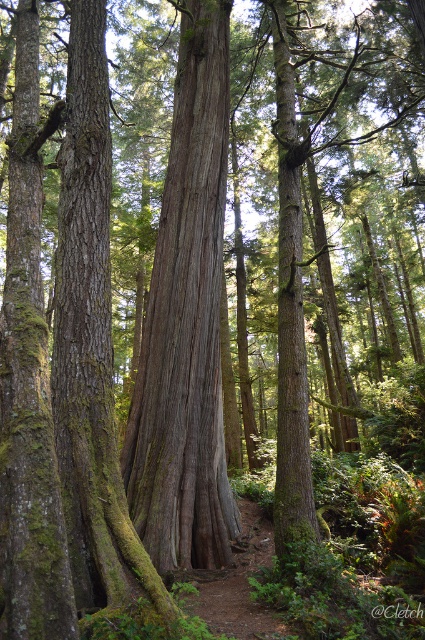
Question: Is brown rough bark tree trunk at center positioned at the back of green mossy bark tree trunk at left?

Choices:
 (A) yes
 (B) no

Answer: (A)

Question: Is brown rough bark tree trunk at center positioned before green mossy bark tree trunk at left?

Choices:
 (A) yes
 (B) no

Answer: (B)

Question: Which object is the closest to the green mossy bark tree trunk at left?

Choices:
 (A) dirt path at center
 (B) brown rough bark tree trunk at center

Answer: (A)

Question: Estimate the real-world distances between objects in this image. Which object is closer to the brown rough bark tree trunk at center?

Choices:
 (A) dirt path at center
 (B) green mossy bark tree trunk at left

Answer: (B)

Question: Is green mossy bark tree trunk at left further to camera compared to dirt path at center?

Choices:
 (A) no
 (B) yes

Answer: (A)

Question: Which object appears closest to the camera in this image?

Choices:
 (A) green mossy bark tree trunk at left
 (B) brown rough bark tree trunk at center

Answer: (A)